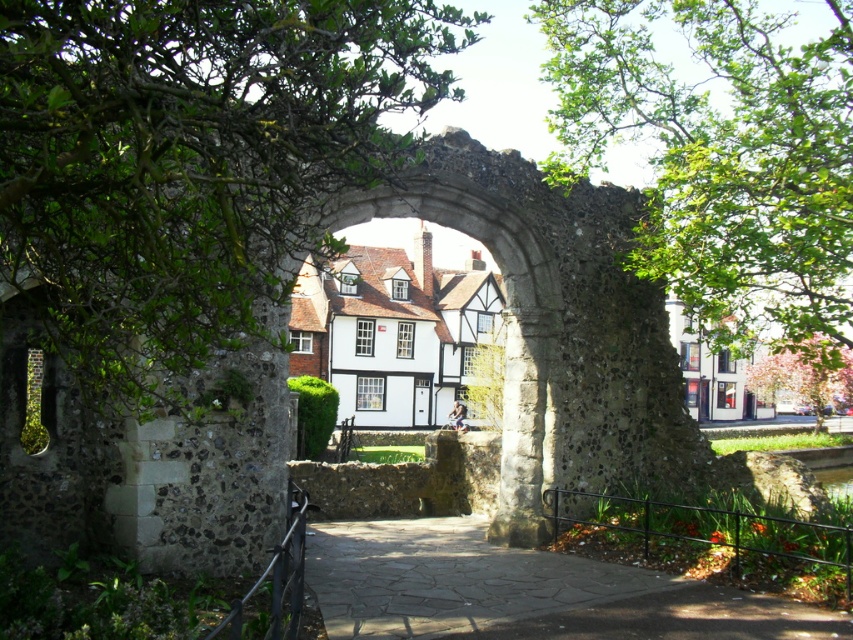
Consider the image. You are standing in front of the stone archway and want to walk through to the courtyard beyond. As you look at the green leafy tree at center and the paved stone path at center, which one is blocking your direct path to the courtyard?

The green leafy tree at center is located above the paved stone path at center, so the tree is blocking the direct path to the courtyard.

You are standing at the entrance of the archway and want to walk towards the Tudor house. Which object, the paved stone path at center or the pink blossoming tree at right, would you encounter first?

The paved stone path at center is closer to the viewer than the pink blossoming tree at right, so you would encounter the paved stone path at center first.